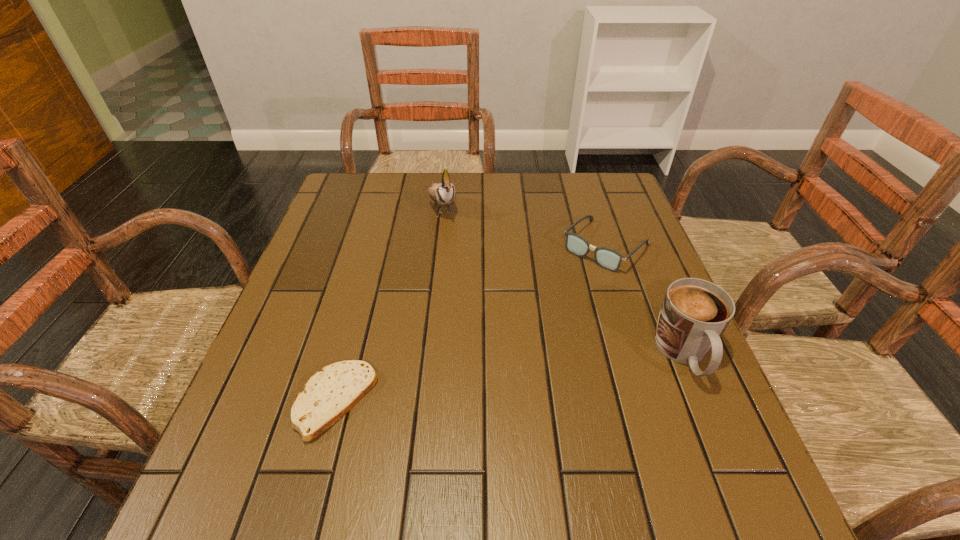
Where is `vacant space located at the face of the bird`? This screenshot has width=960, height=540. vacant space located at the face of the bird is located at coordinates (458, 255).

Locate an element on the screen. vacant region located 0.200m at the face of the bird is located at coordinates (466, 273).

This screenshot has height=540, width=960. In order to click on blank area located 0.140m at the face of the bird in this screenshot , I will do `click(459, 258)`.

Locate an element on the screen. object at the far edge is located at coordinates (443, 193).

What are the coordinates of `object located in the near edge section of the desktop` in the screenshot? It's located at (328, 395).

This screenshot has height=540, width=960. I want to click on object situated at the left edge, so click(328, 395).

What are the coordinates of `mug at the right edge` in the screenshot? It's located at (694, 314).

Image resolution: width=960 pixels, height=540 pixels. Identify the location of spectacles that is at the right edge. (609, 259).

Find the location of `object situated at the near left corner`. object situated at the near left corner is located at coordinates (328, 395).

At what (x,y) coordinates should I click in order to perform the action: click on free space at the far edge. Please return your answer as a coordinate pair (x, y). Looking at the image, I should click on (469, 179).